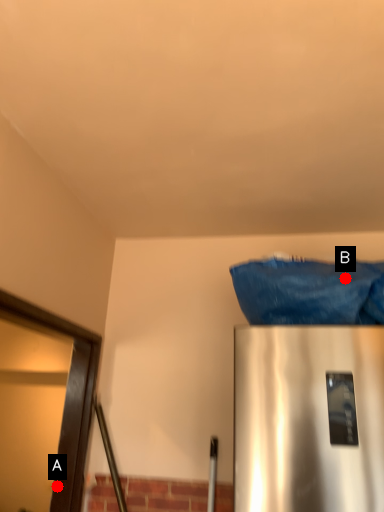
Question: Two points are circled on the image, labeled by A and B beside each circle. Which point appears closest to the camera in this image?

Choices:
 (A) A is closer
 (B) B is closer

Answer: (B)